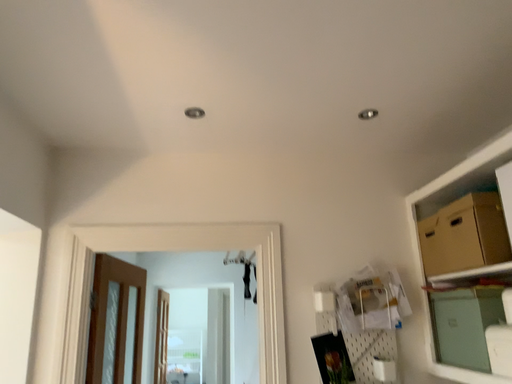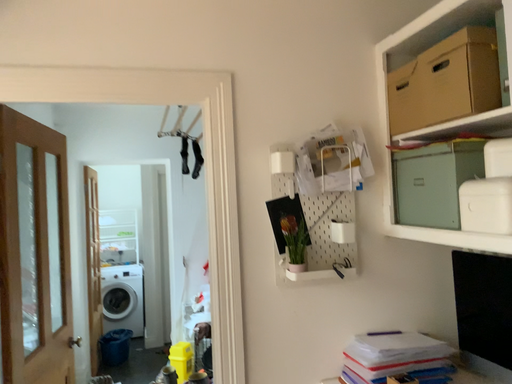
Question: How did the camera likely rotate when shooting the video?

Choices:
 (A) rotated upward
 (B) rotated downward

Answer: (B)